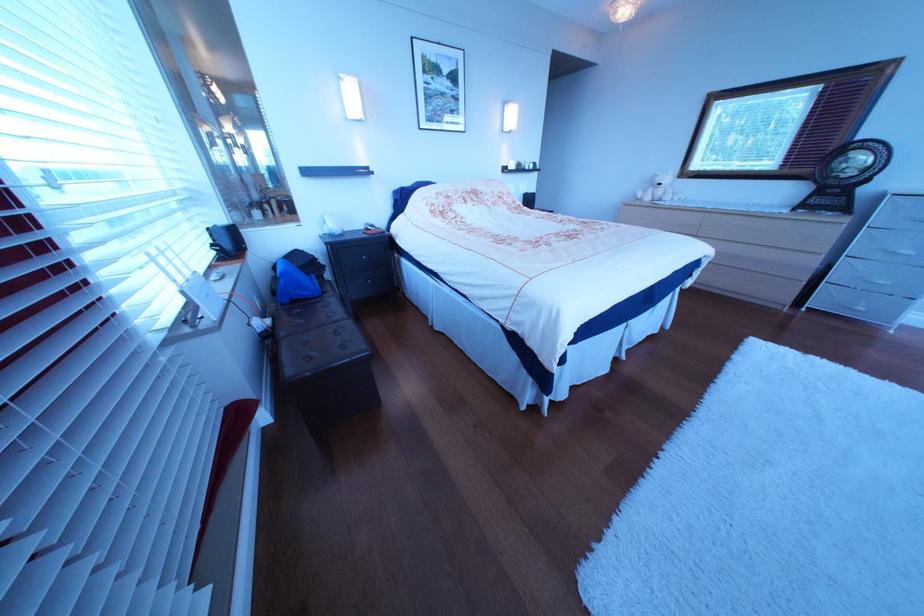
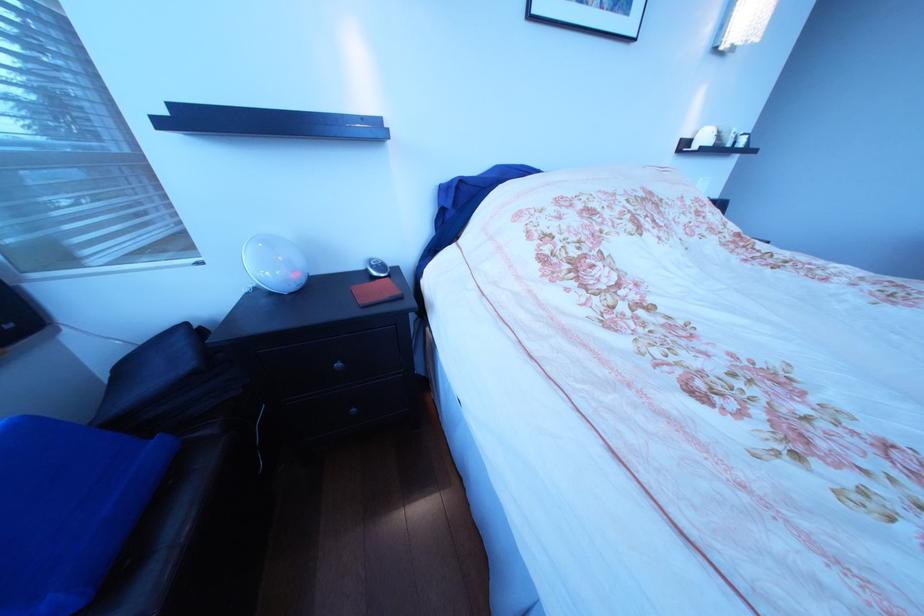
Locate, in the second image, the point that corresponds to pixel 385 232 in the first image.

(388, 281)